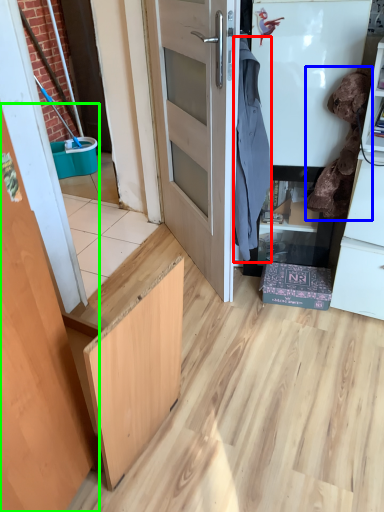
Question: Considering the real-world distances, which object is closest to laundry (highlighted by a red box)? laundry (highlighted by a blue box) or door (highlighted by a green box).

Choices:
 (A) laundry
 (B) door

Answer: (A)